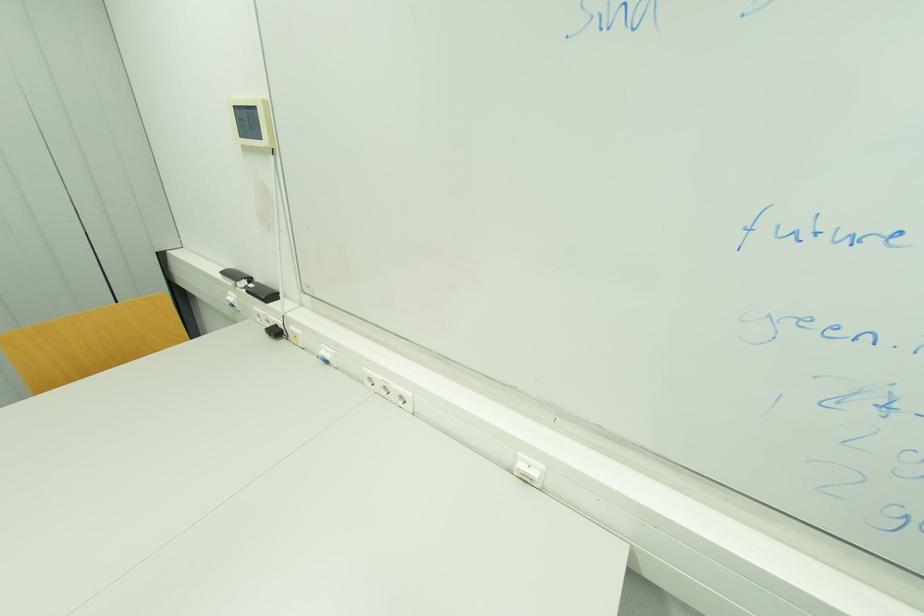
Locate an element on the screen. black plug is located at coordinates (274, 331).